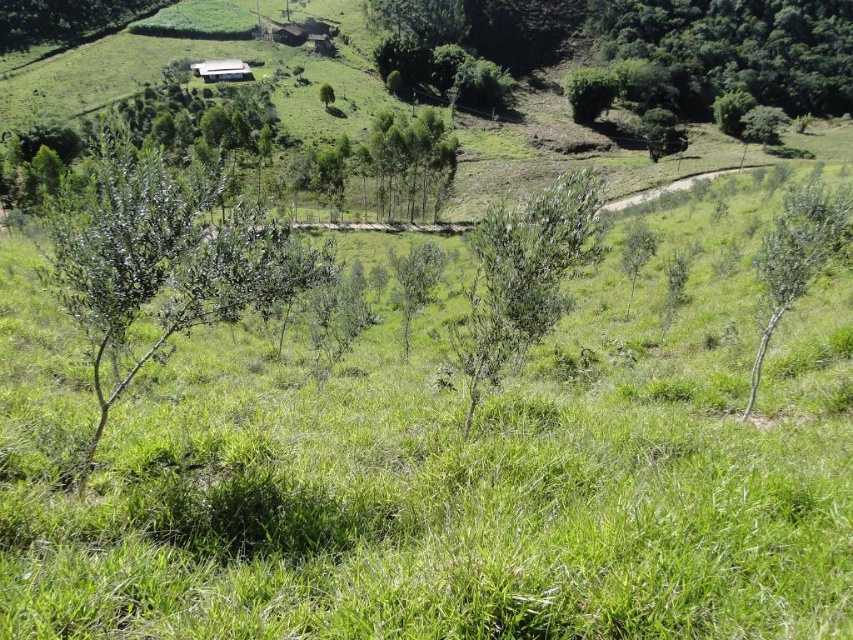
You are standing at the point marked by the coordinates point (300, 35). Looking around, you see the brown wooden hut at center. Which direction should you face to see the cluster of buildings nestled among the vegetation in the mid to far distance?

The brown wooden hut at center is located at point (300, 35). Since the cluster of buildings is in the mid to far distance beyond the line of mature trees in the mid ground, you should face towards the direction opposite the slope leading away from the hut to see the cluster of buildings.

You are standing at the top of the valley and see two points in the landscape. The first point is at coordinate point (138, 252), and the second point is at coordinate point (401, 300). From your vantage point, which point is closer to you?

Point (138, 252) is in front of point (401, 300), so it is closer to you.